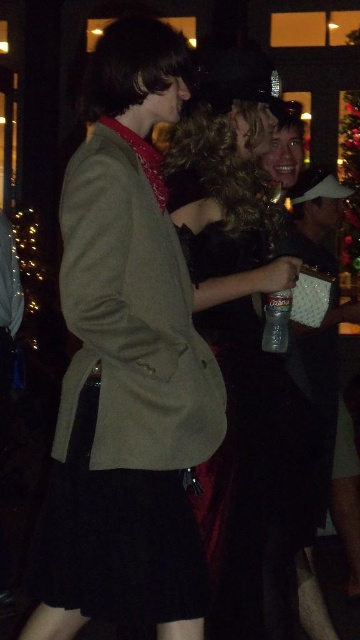
Based on the photo, which is below, velvet black dress at center or green fabric christmas tree at upper right?

velvet black dress at center is lower down.

Between velvet black dress at center and green fabric christmas tree at upper right, which one has more height?

velvet black dress at center is taller.

The image size is (360, 640). Identify the location of velvet black dress at center. (245, 342).

Where is `velvet black dress at center`? The height and width of the screenshot is (640, 360). velvet black dress at center is located at coordinates coord(245,342).

Measure the distance from black cotton dress at center to green fabric christmas tree at upper right.

The distance of black cotton dress at center from green fabric christmas tree at upper right is 5.43 meters.

In order to click on black cotton dress at center in this screenshot , I will do coord(127,403).

Who is more forward, (64, 573) or (285, 384)?

Point (64, 573) is in front.

Is black cotton dress at center bigger than velvet black dress at center?

No, black cotton dress at center is not bigger than velvet black dress at center.

Is point (200, 593) farther from viewer compared to point (268, 385)?

No, (200, 593) is in front of (268, 385).

Identify the location of black cotton dress at center. This screenshot has height=640, width=360. (127, 403).